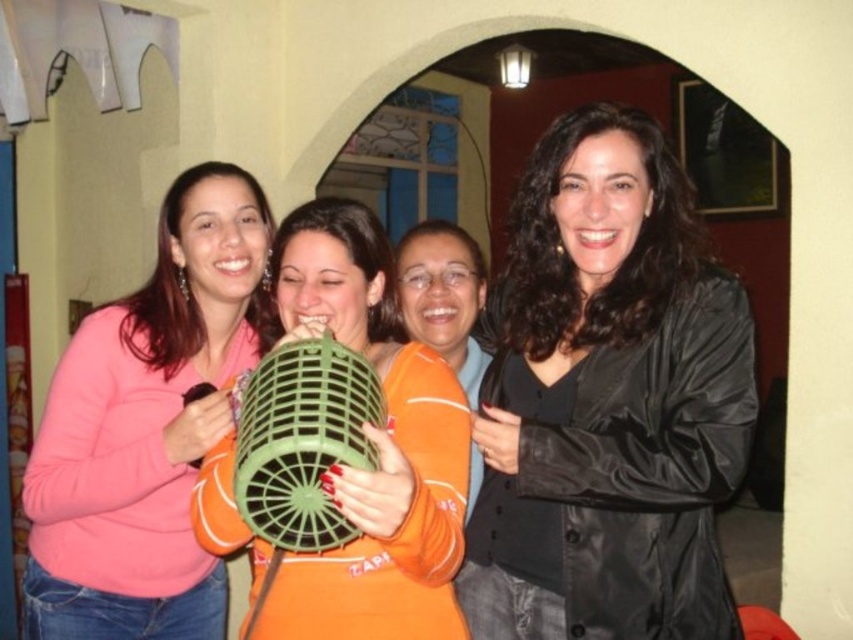
Question: Is black shiny jacket at center smaller than green matte fan at center?

Choices:
 (A) yes
 (B) no

Answer: (B)

Question: Can you confirm if pink matte sweater at left is positioned above orange fabric pillow at center?

Choices:
 (A) yes
 (B) no

Answer: (B)

Question: Is pink matte sweater at left thinner than green matte fan at center?

Choices:
 (A) no
 (B) yes

Answer: (A)

Question: Which object is positioned closest to the black shiny jacket at center?

Choices:
 (A) orange fabric pillow at center
 (B) pink matte sweater at left

Answer: (A)

Question: Which of these objects is positioned farthest from the orange fabric pillow at center?

Choices:
 (A) black shiny jacket at center
 (B) pink matte sweater at left
 (C) green matte fan at center

Answer: (B)

Question: Which of the following is the closest to the observer?

Choices:
 (A) black shiny jacket at center
 (B) green matte fan at center
 (C) orange fabric pillow at center

Answer: (B)